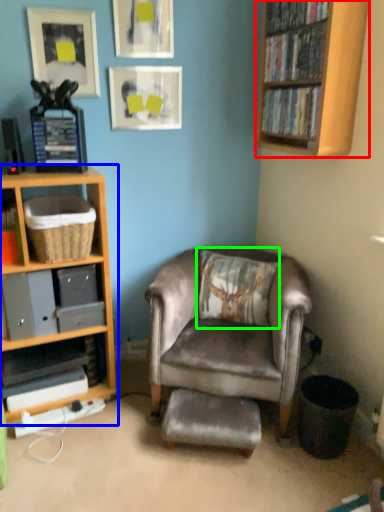
Question: Estimate the real-world distances between objects in this image. Which object is closer to bookcase (highlighted by a red box), shelf (highlighted by a blue box) or pillow (highlighted by a green box)?

Choices:
 (A) shelf
 (B) pillow

Answer: (B)